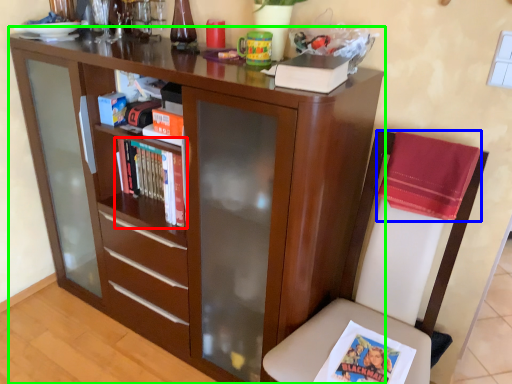
Question: Considering the real-world distances, which object is farthest from book (highlighted by a red box)? cloth (highlighted by a blue box) or bookcase (highlighted by a green box)?

Choices:
 (A) cloth
 (B) bookcase

Answer: (A)